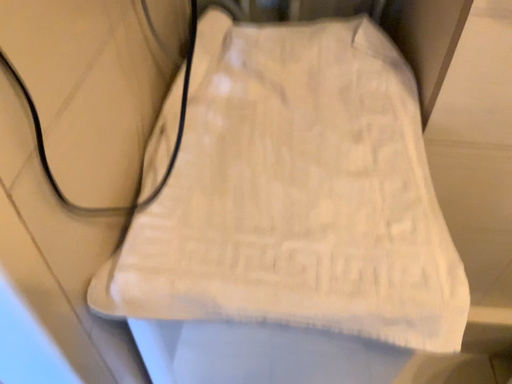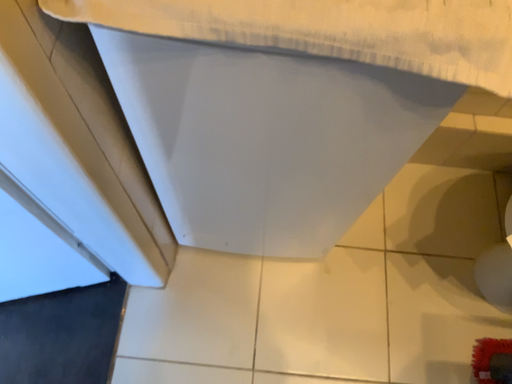
Question: Which way did the camera rotate in the video?

Choices:
 (A) rotated upward
 (B) rotated downward

Answer: (B)